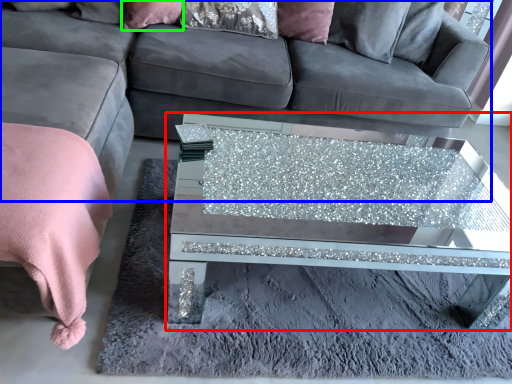
Question: Estimate the real-world distances between objects in this image. Which object is closer to coffee table (highlighted by a red box), studio couch (highlighted by a blue box) or pillow (highlighted by a green box)?

Choices:
 (A) studio couch
 (B) pillow

Answer: (A)